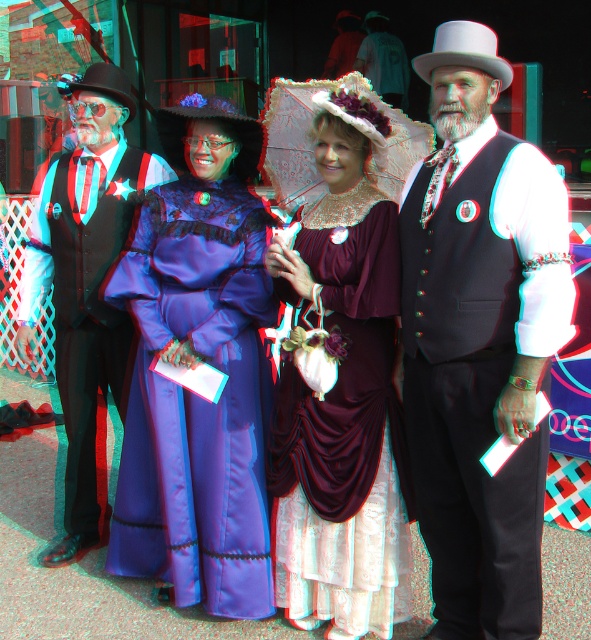
You are standing in front of the group of people at the historical event. You notice two points marked in the image. The first point is at coordinates point (215, 589) and the second is at point (369, 129). Which point is closer to you?

Point (215, 589) is closer to you because it is further to the camera than point (369, 129).

You are standing in front of the scene and want to find the satin purple dress at center. Which direction should you look relative to the black suit with red and blue stars on the far left?

The satin purple dress at center is located to the right of the black suit with red and blue stars on the far left.

Consider the image. You are a photographer at the event and want to capture both the satin purple dress at center and the patterned fabric umbrella at center in a single shot. Which object should you adjust to ensure both are fully visible in the frame?

The patterned fabric umbrella at center is behind the satin purple dress at center, so you should move the umbrella forward or the dress backward to ensure both are visible in the frame.